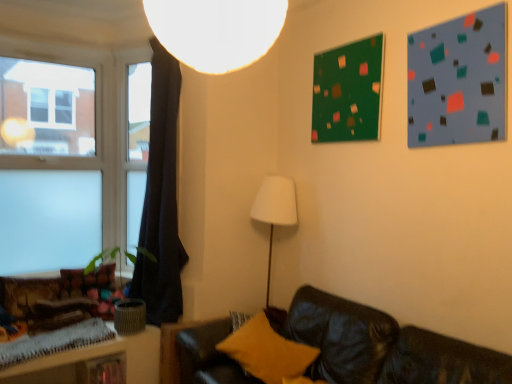
In order to click on empty space that is ontop of transparent glass window at left (from a real-world perspective) in this screenshot , I will do `click(52, 45)`.